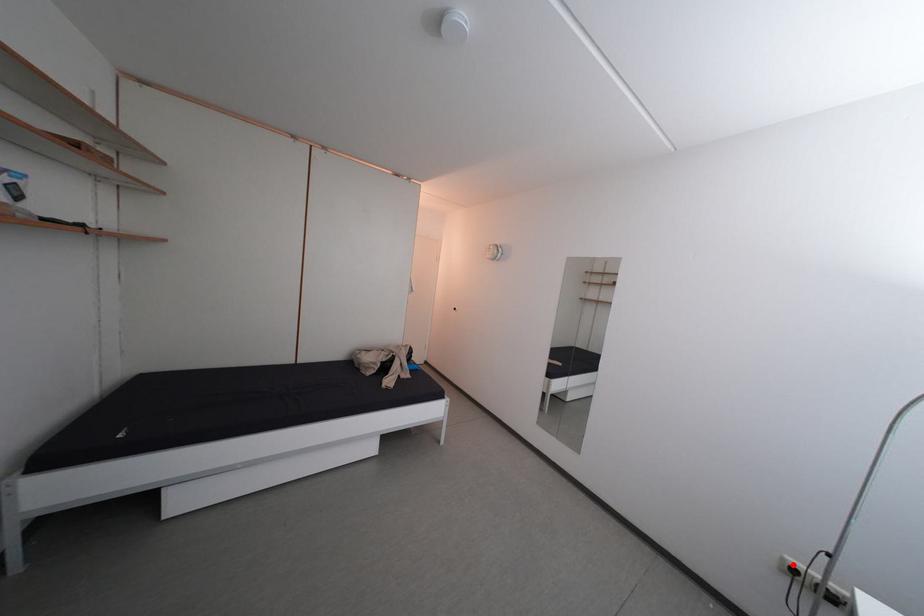
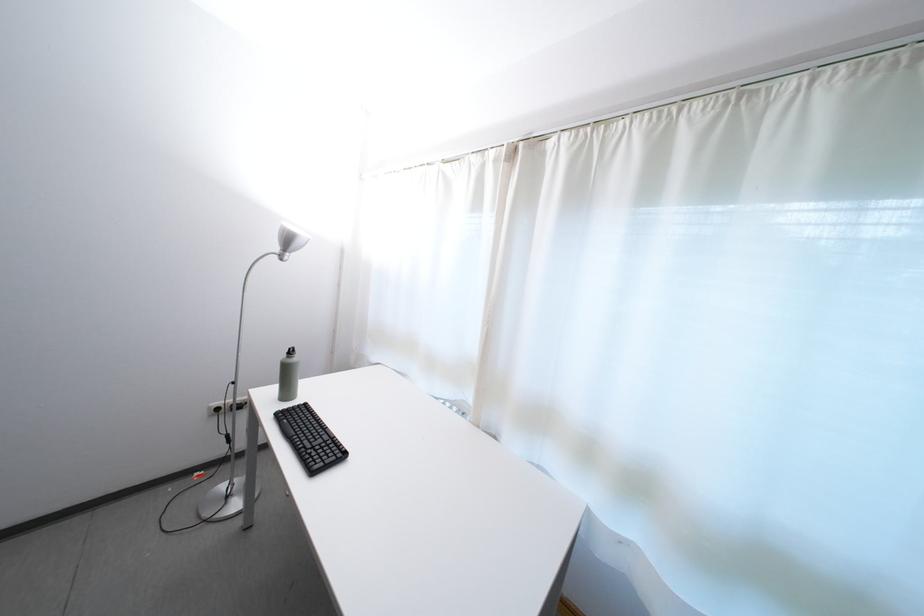
Question: I am providing you with two images of the same scene from different viewpoints. Image1 has a red point marked. In image2, the corresponding 3D location appears at what relative position? Reply with the corresponding letter.

Choices:
 (A) Closer
 (B) Farther

Answer: (A)